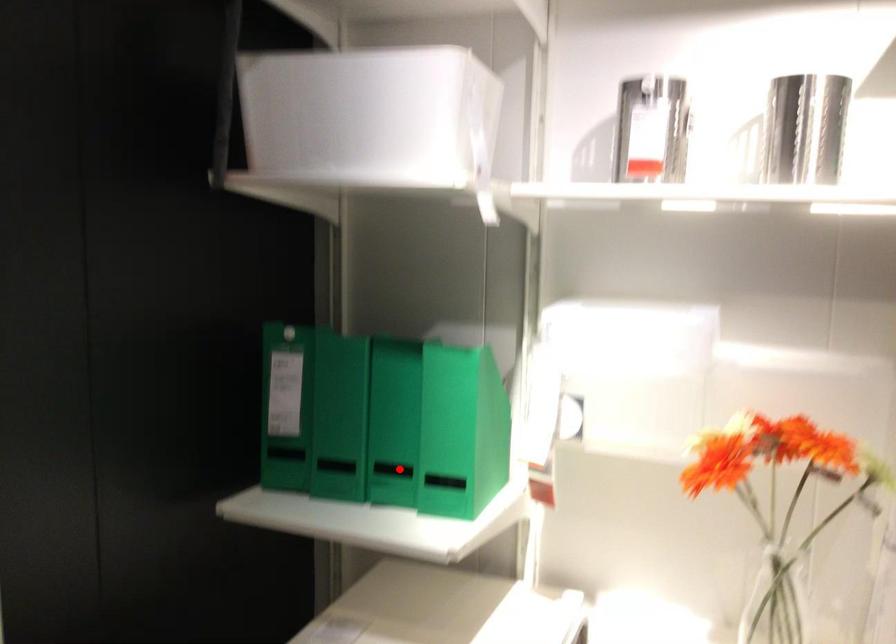
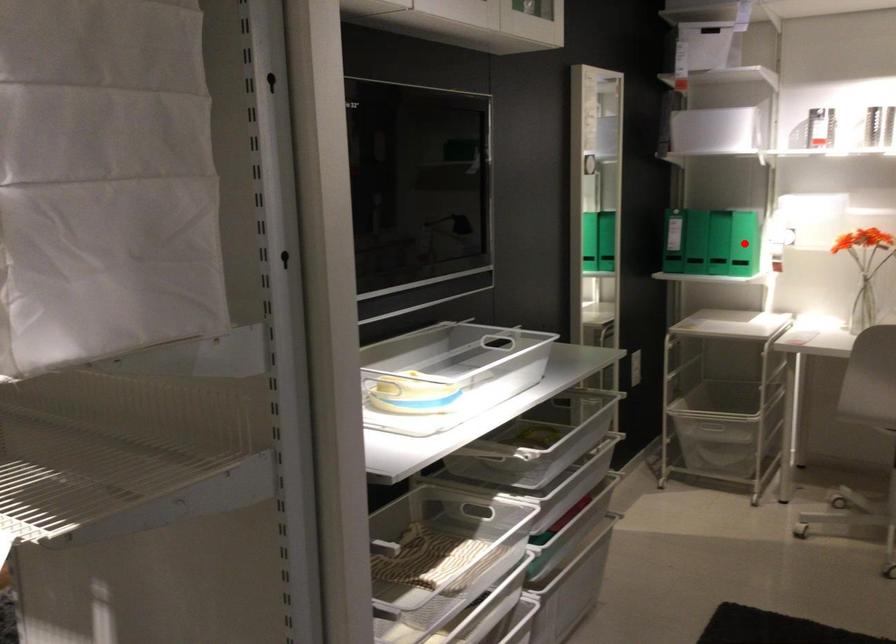
I am providing you with two images of the same scene from different viewpoints. A red point is marked on the first image and another point is marked on the second image. Does the point marked in image1 correspond to the same location as the one in image2?

Yes